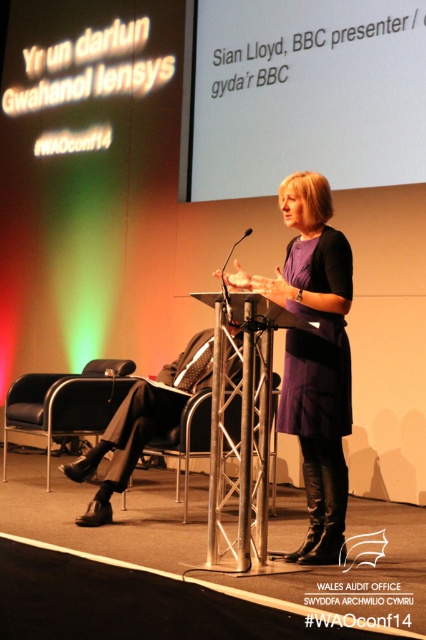
What object is located at the coordinates point (241,429) in the image?

The point (241,429) marks the metallic silver podium at center.

You are attending a conference and need to sit down. You see a black leather chair at lower left and a metallic silver chair at center. Which chair is closer to the front of the room?

The black leather chair at lower left is closer to the front of the room because the metallic silver chair at center is positioned behind it.

You are an event organizer setting up the stage for a panel discussion. You need to place a metallic silver podium at center and a metallic silver chair at center. Given their sizes, which object should you place first to ensure there is enough space for both?

The metallic silver podium at center has a lesser width compared to the metallic silver chair at center. Therefore, you should place the metallic silver chair at center first to accommodate its larger size, ensuring there is sufficient space for both objects.